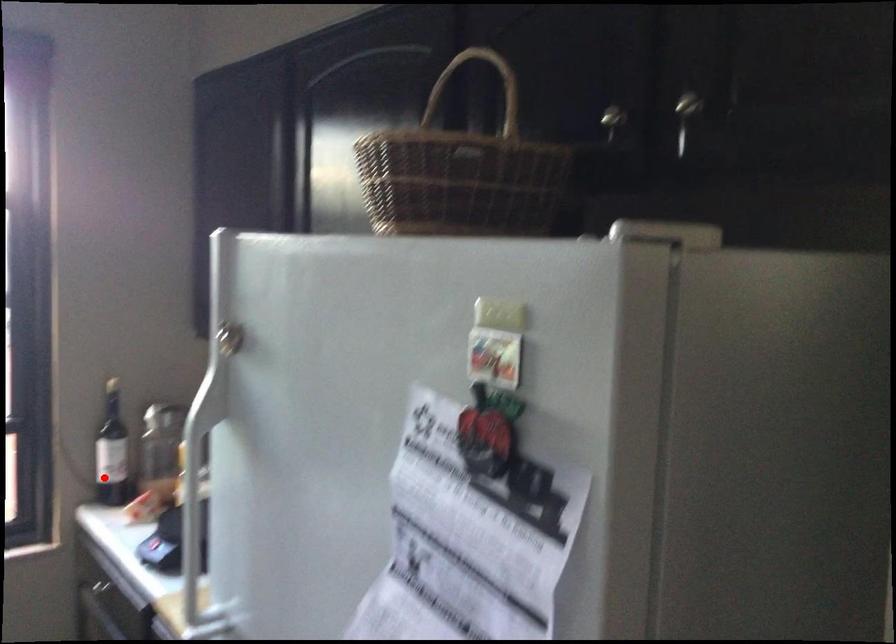
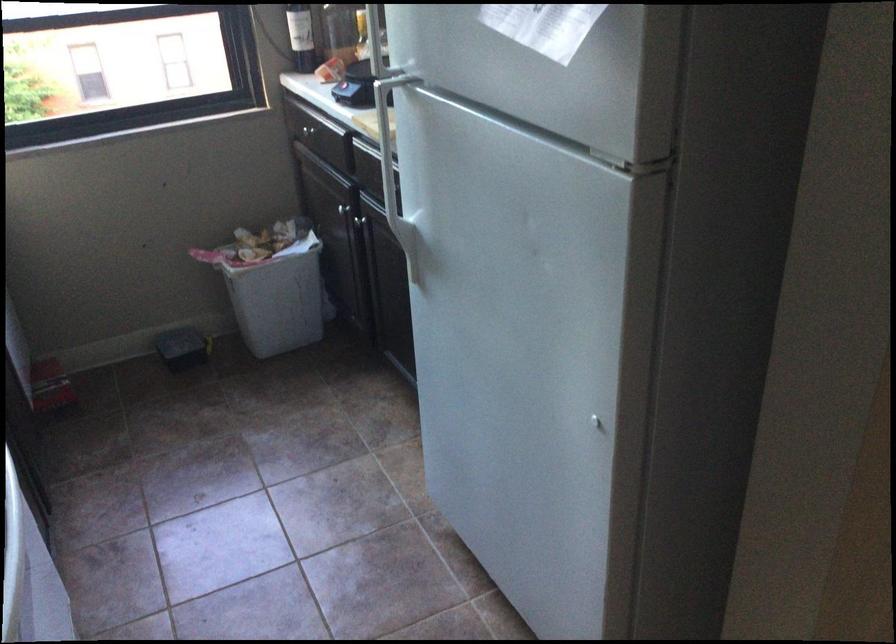
Question: I am providing you with two images of the same scene from different viewpoints. A red point is marked on the first image. Can you still see the location of the red point in image 2?

Choices:
 (A) Yes
 (B) No

Answer: (A)